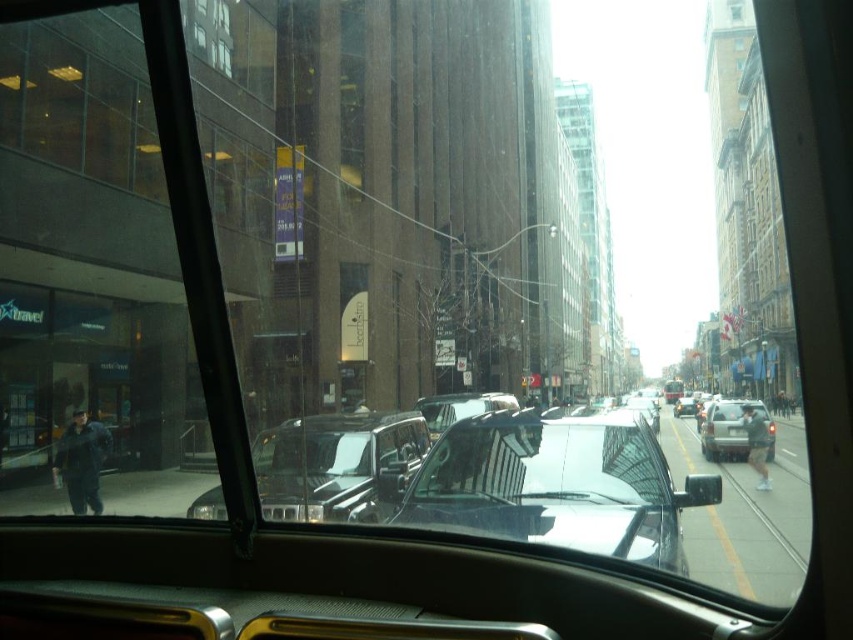
You are sitting in the driver seat of the vehicle in the image. You notice a point at coordinates (552, 484). What object is located at that point?

The transparent glass windshield at center is located at point (552, 484).

You are driving a car and want to check if the silver metallic suv at center is visible through the transparent glass windshield at center. Can you see it?

The transparent glass windshield at center is closer to the viewer than the silver metallic suv at center, so yes, the suv is visible through the windshield.